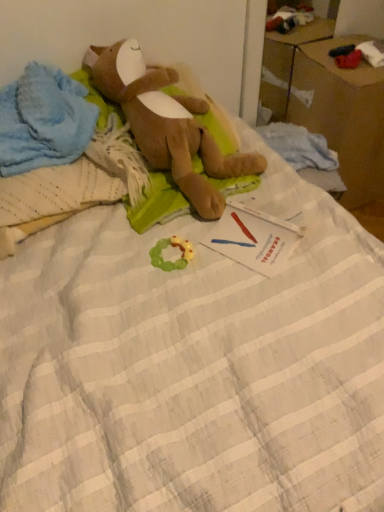
Question: Is brown cardboard box at upper right shorter than brown plush toy at upper left, the second toy positioned from the bottom?

Choices:
 (A) no
 (B) yes

Answer: (A)

Question: Are brown cardboard box at upper right and brown plush toy at upper left, which is the first toy from top to bottom, far apart?

Choices:
 (A) yes
 (B) no

Answer: (B)

Question: Considering the relative sizes of brown cardboard box at upper right and brown plush toy at upper left, which is the first toy from top to bottom, in the image provided, is brown cardboard box at upper right bigger than brown plush toy at upper left, which is the first toy from top to bottom,?

Choices:
 (A) no
 (B) yes

Answer: (B)

Question: Is the surface of brown cardboard box at upper right in direct contact with brown plush toy at upper left, which is the second toy from back to front?

Choices:
 (A) yes
 (B) no

Answer: (B)

Question: Is brown cardboard box at upper right thinner than brown plush toy at upper left, the second toy positioned from the bottom?

Choices:
 (A) no
 (B) yes

Answer: (A)

Question: Relative to blue soft fabric at upper left, is green rubber teething ring at center, which ranks as the first toy in bottom-to-top order, in front or behind?

Choices:
 (A) behind
 (B) front

Answer: (A)

Question: Based on their positions, is green rubber teething ring at center, the 2th toy when ordered from top to bottom, located to the left or right of blue soft fabric at upper left?

Choices:
 (A) left
 (B) right

Answer: (B)

Question: Is green rubber teething ring at center, the 2th toy positioned from the front, wider or thinner than blue soft fabric at upper left?

Choices:
 (A) thin
 (B) wide

Answer: (A)

Question: Is green rubber teething ring at center, the 2th toy when ordered from top to bottom, situated inside blue soft fabric at upper left or outside?

Choices:
 (A) inside
 (B) outside

Answer: (B)

Question: Is green rubber teething ring at center, which ranks as the first toy in bottom-to-top order, bigger or smaller than brown plush toy at upper left, the second toy positioned from the bottom?

Choices:
 (A) small
 (B) big

Answer: (A)

Question: Is green rubber teething ring at center, the 2th toy positioned from the front, spatially inside brown plush toy at upper left, the second toy positioned from the bottom, or outside of it?

Choices:
 (A) inside
 (B) outside

Answer: (B)

Question: From their relative heights in the image, would you say green rubber teething ring at center, which ranks as the first toy in bottom-to-top order, is taller or shorter than brown plush toy at upper left, which is the second toy from back to front?

Choices:
 (A) tall
 (B) short

Answer: (B)

Question: Is point (155, 263) positioned closer to the camera than point (215, 205)?

Choices:
 (A) farther
 (B) closer

Answer: (B)

Question: From a real-world perspective, is brown cardboard box at upper right positioned above or below green rubber teething ring at center, which ranks as the first toy in bottom-to-top order?

Choices:
 (A) above
 (B) below

Answer: (B)

Question: In the image, is brown cardboard box at upper right positioned in front of or behind green rubber teething ring at center, which appears as the 1th toy when viewed from the back?

Choices:
 (A) front
 (B) behind

Answer: (B)